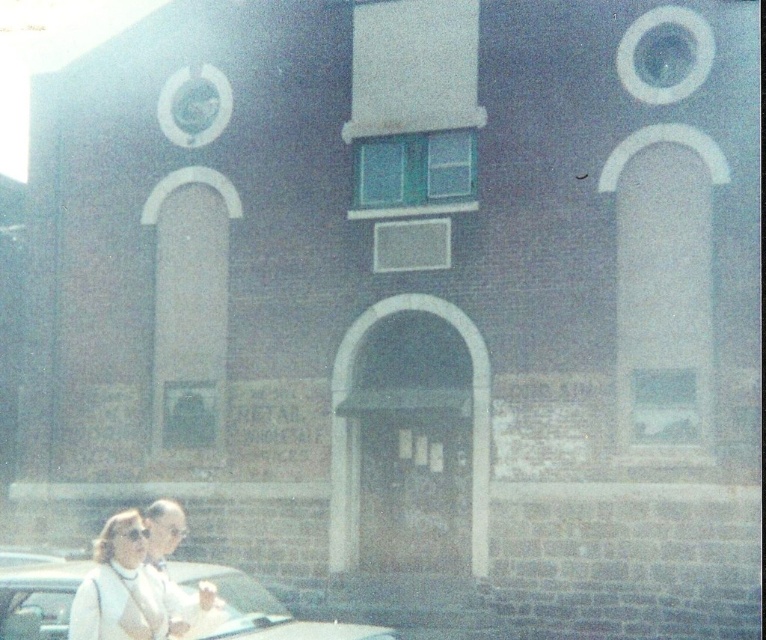
Measure the distance between metallic silver car at lower left and white fabric coat at lower left.

metallic silver car at lower left is 2.53 meters away from white fabric coat at lower left.

Who is taller, metallic silver car at lower left or white fabric coat at lower left?

white fabric coat at lower left is taller.

Does point (51, 625) come in front of point (146, 560)?

Yes.

This screenshot has height=640, width=766. I want to click on metallic silver car at lower left, so click(257, 609).

Is white matte jacket at lower left smaller than white fabric coat at lower left?

Correct, white matte jacket at lower left occupies less space than white fabric coat at lower left.

Can you confirm if white matte jacket at lower left is taller than white fabric coat at lower left?

No.

I want to click on white matte jacket at lower left, so click(x=120, y=588).

Locate an element on the screen. The image size is (766, 640). white matte jacket at lower left is located at coordinates (120, 588).

Can you confirm if metallic silver car at lower left is positioned below white matte jacket at lower left?

Yes, metallic silver car at lower left is below white matte jacket at lower left.

Does metallic silver car at lower left lie behind white matte jacket at lower left?

Yes, metallic silver car at lower left is further from the viewer.

What are the coordinates of `metallic silver car at lower left` in the screenshot? It's located at (257, 609).

Where is `metallic silver car at lower left`? metallic silver car at lower left is located at coordinates (257, 609).